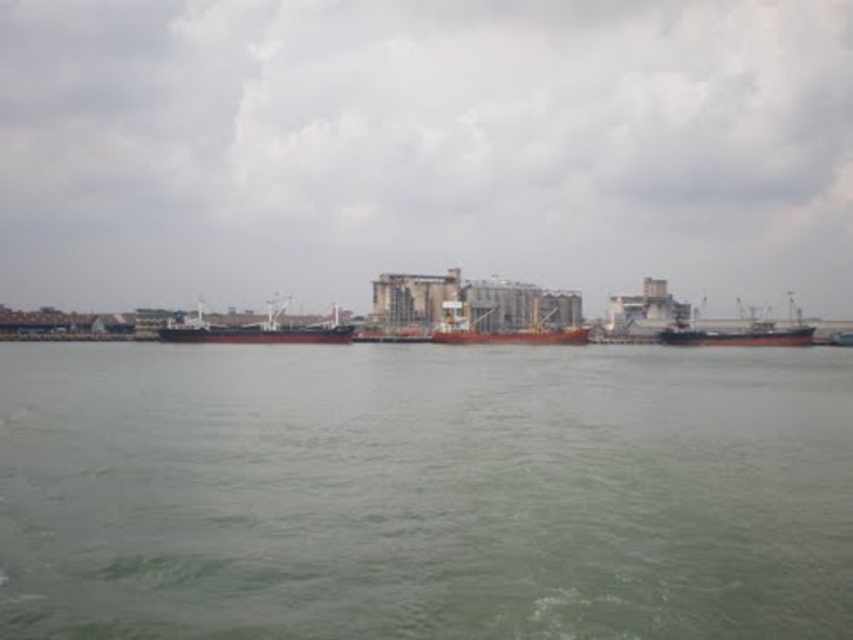
You are a crane operator at the port, and you need to lower a heavy container onto the green water at center. However, you must ensure that the container doesn not hit the red matte ship at right. Based on the scene, is this possible?

The green water at center has a lesser height compared to the red matte ship at right. Since the water is lower, the container can be safely lowered onto the green water at center without hitting the ship.

You are a crane operator at the port and need to lower a heavy container onto the red matte cargo ship at center. The green water at center is directly beneath the ship. Should you be concerned about the water level affecting the container placement?

The green water at center is positioned under the red matte cargo ship at center, so the water level is normal and the container can be safely lowered onto the ship without any issues related to the water level.